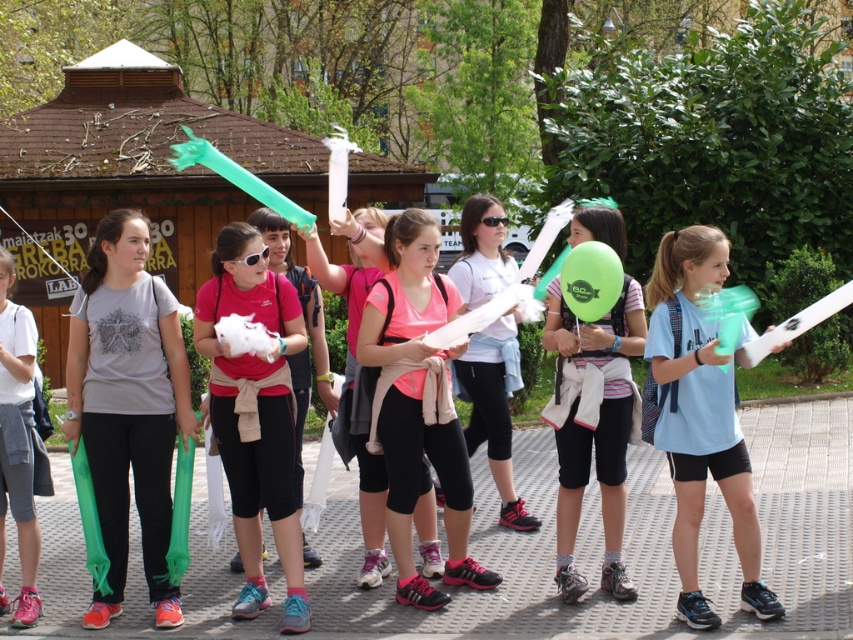
Question: Which object is the closest to the light blue fabric balloon at center?

Choices:
 (A) matte green balloon at center
 (B) matte pink shirt at center

Answer: (A)

Question: Which of these objects is positioned closest to the matte white balloon at center?

Choices:
 (A) matte gray t-shirt at center
 (B) matte pink shirt at center
 (C) light blue fabric balloon at center

Answer: (C)

Question: Among these points, which one is nearest to the camera?

Choices:
 (A) (78, 349)
 (B) (281, 288)
 (C) (495, 387)
 (D) (30, 620)

Answer: (D)

Question: Is light blue fabric balloon at center smaller than matte white balloon at center?

Choices:
 (A) no
 (B) yes

Answer: (A)

Question: Is pink matte tank top at center in front of matte white balloon at center?

Choices:
 (A) no
 (B) yes

Answer: (B)

Question: Does light blue fabric balloon at center have a lesser width compared to white cotton shirt at center?

Choices:
 (A) yes
 (B) no

Answer: (B)